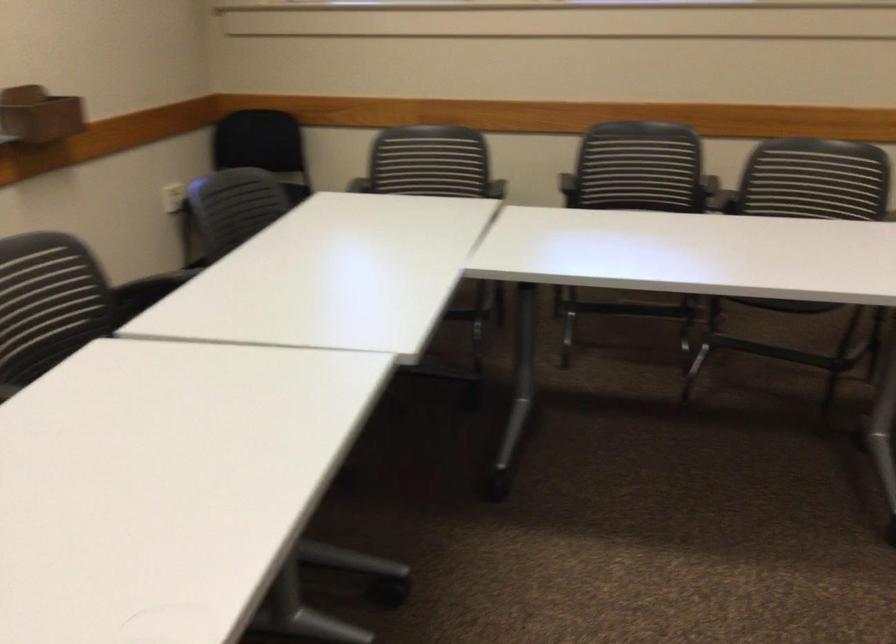
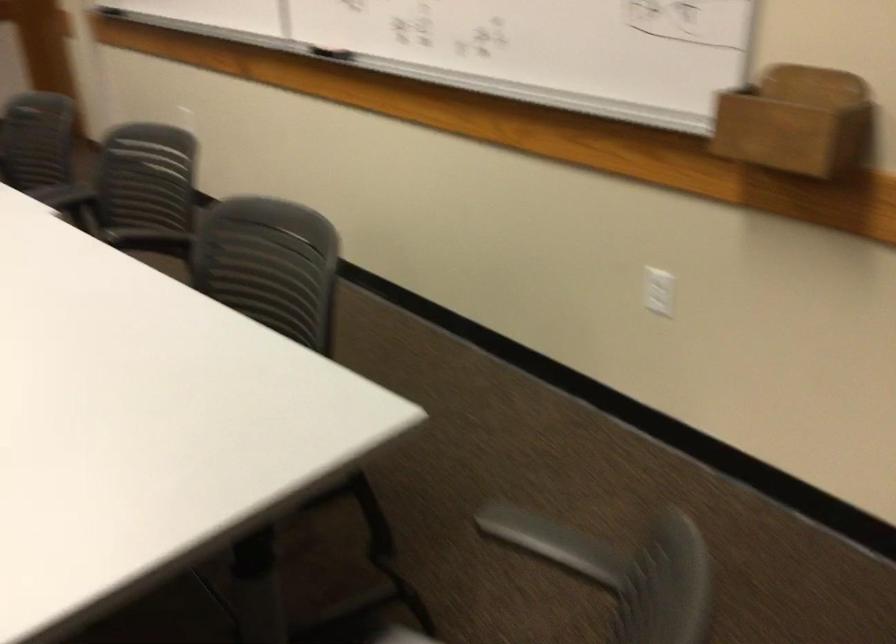
The point at (73, 111) is marked in the first image. Where is the corresponding point in the second image?

(797, 122)